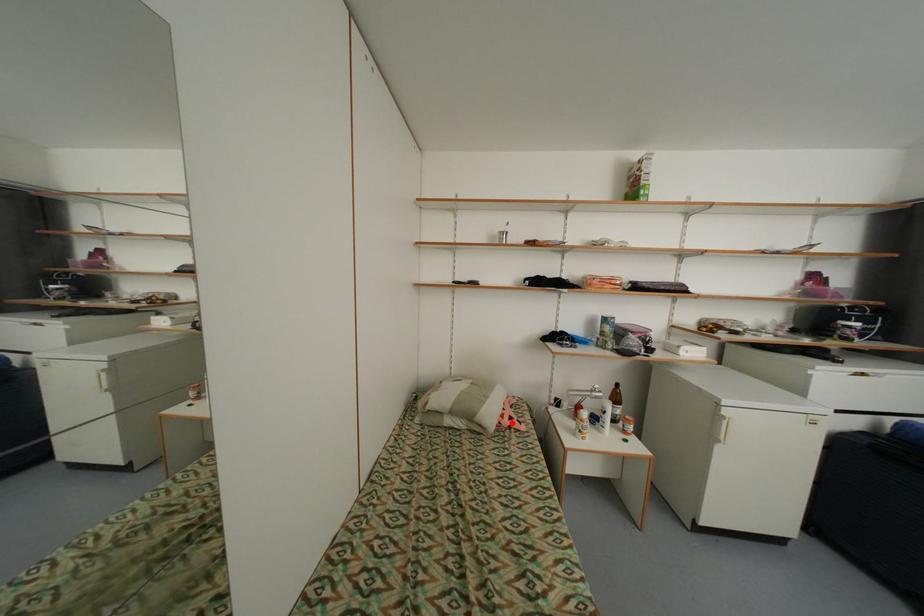
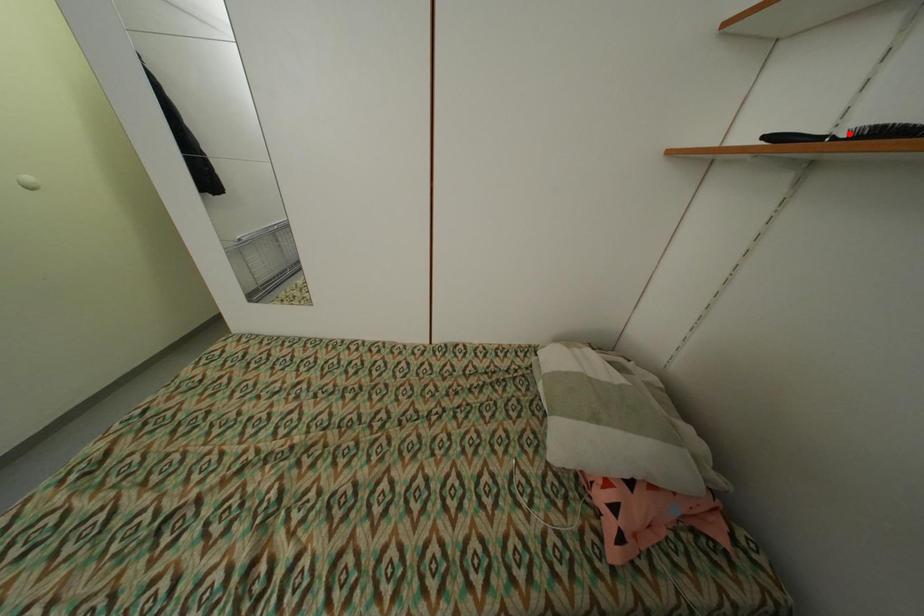
I am providing you with two images of the same scene from different viewpoints. A red point is marked on the first image and another point is marked on the second image. Do the highlighted points in image1 and image2 indicate the same real-world spot?

No